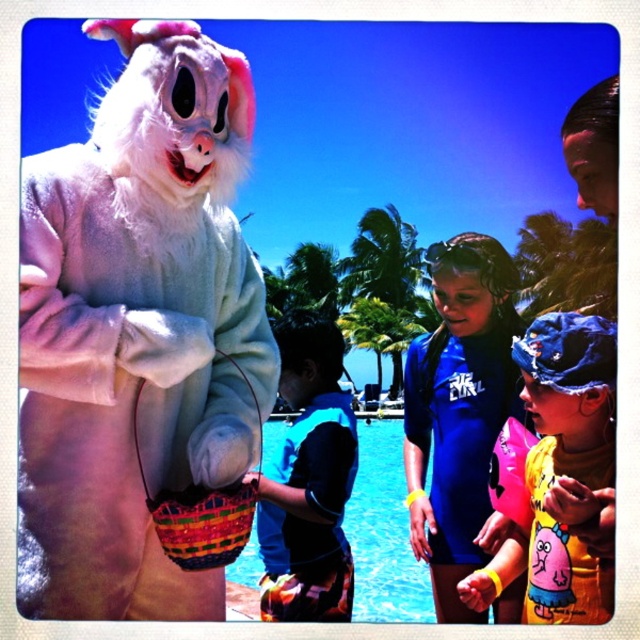
Measure the distance between fluffy white bunny at upper left and camera.

A distance of 10.22 meters exists between fluffy white bunny at upper left and camera.

Who is shorter, fluffy white bunny at upper left or yellow rubber arm band at lower right?

With less height is yellow rubber arm band at lower right.

What do you see at coordinates (136, 330) in the screenshot? The height and width of the screenshot is (640, 640). I see `fluffy white bunny at upper left` at bounding box center [136, 330].

Identify the location of fluffy white bunny at upper left. Image resolution: width=640 pixels, height=640 pixels. (136, 330).

Does fluffy white bunny at upper left have a greater height compared to bright multicolored woven basket at lower left?

Correct, fluffy white bunny at upper left is much taller as bright multicolored woven basket at lower left.

Which is behind, point (141, 115) or point (240, 512)?

The point (240, 512) is more distant.

The width and height of the screenshot is (640, 640). I want to click on fluffy white bunny at upper left, so click(136, 330).

Between blue glossy pool at center and bright multicolored woven basket at lower left, which one is positioned lower?

blue glossy pool at center is below.

Is blue glossy pool at center above bright multicolored woven basket at lower left?

No, blue glossy pool at center is not above bright multicolored woven basket at lower left.

Locate an element on the screen. blue glossy pool at center is located at coordinates (385, 531).